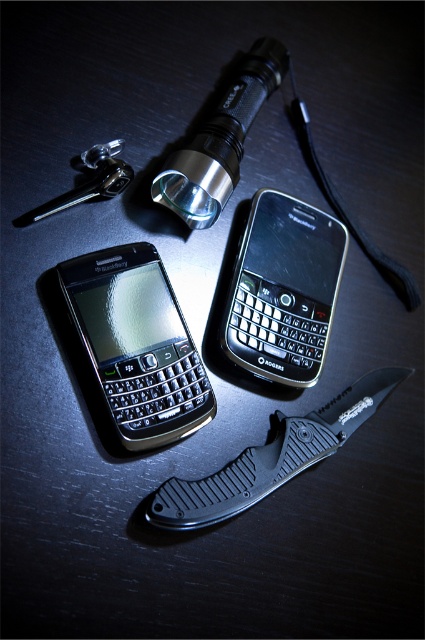
Between black matte/black textured phone at center-left and black matte/black textured phone at center, which one appears on the right side from the viewer's perspective?

From the viewer's perspective, black matte/black textured phone at center appears more on the right side.

Can you confirm if black matte/black textured phone at center-left is positioned to the right of black matte/black textured phone at center?

No, black matte/black textured phone at center-left is not to the right of black matte/black textured phone at center.

You are a GUI agent. You are given a task and a screenshot of the screen. Output one action in this format:
    pyautogui.click(x=<x>, y=<y>)
    Task: Click on the black matte/black textured phone at center-left
    This screenshot has width=425, height=640.
    Given the screenshot: What is the action you would take?
    pyautogui.click(x=138, y=344)

Who is positioned more to the right, black matte/black textured phone at center or black textured knife at lower center?

black matte/black textured phone at center is more to the right.

This screenshot has height=640, width=425. What do you see at coordinates (283, 289) in the screenshot?
I see `black matte/black textured phone at center` at bounding box center [283, 289].

Measure the distance between point [300,218] and camera.

The distance of point [300,218] from camera is 4.63 feet.

Identify the location of black matte/black textured phone at center. (283, 289).

Which is in front, point (144, 275) or point (292, 428)?

Point (144, 275)

Is point (189, 381) farther from viewer compared to point (161, 490)?

Yes, point (189, 381) is farther from viewer.

Between point (209, 401) and point (300, 429), which one is positioned behind?

Positioned behind is point (300, 429).

You are a GUI agent. You are given a task and a screenshot of the screen. Output one action in this format:
    pyautogui.click(x=<x>, y=<y>)
    Task: Click on the black matte/black textured phone at center-left
    The width and height of the screenshot is (425, 640).
    Given the screenshot: What is the action you would take?
    pyautogui.click(x=138, y=344)